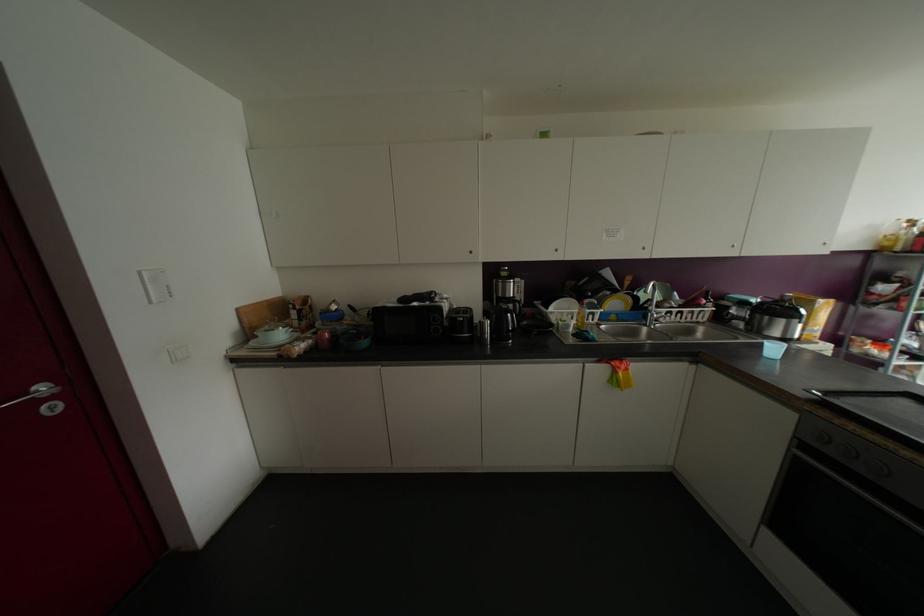
The image size is (924, 616). What do you see at coordinates (772, 349) in the screenshot?
I see `a light blue teacup` at bounding box center [772, 349].